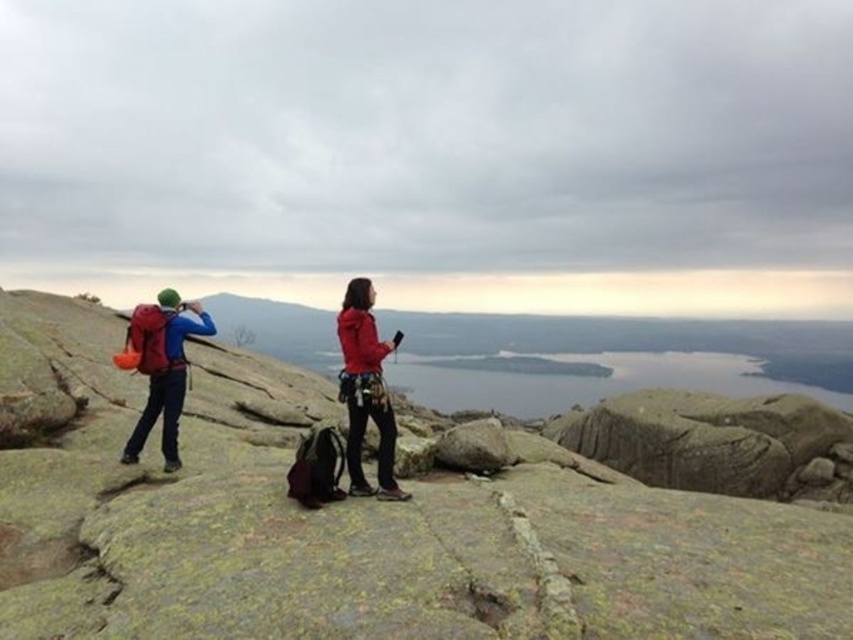
You are a hiker who wants to place a 10 feet long rope between the gray rock at center and the red matte jacket at center. Can you do this without the rope touching the ground?

The distance between the gray rock at center and the red matte jacket at center is 13.42 feet. Since the rope is only 10 feet long, it is not long enough to span the distance between them without touching the ground.

You are a photographer trying to capture a landscape photo. You have a matte blue jacket at center and a matte red backpack at left in your viewfinder. Which object should you adjust your focus to ensure the taller one is in sharp focus?

The matte blue jacket at center is much taller than the matte red backpack at left, so you should focus on the matte blue jacket at center to ensure the taller object is in sharp focus.